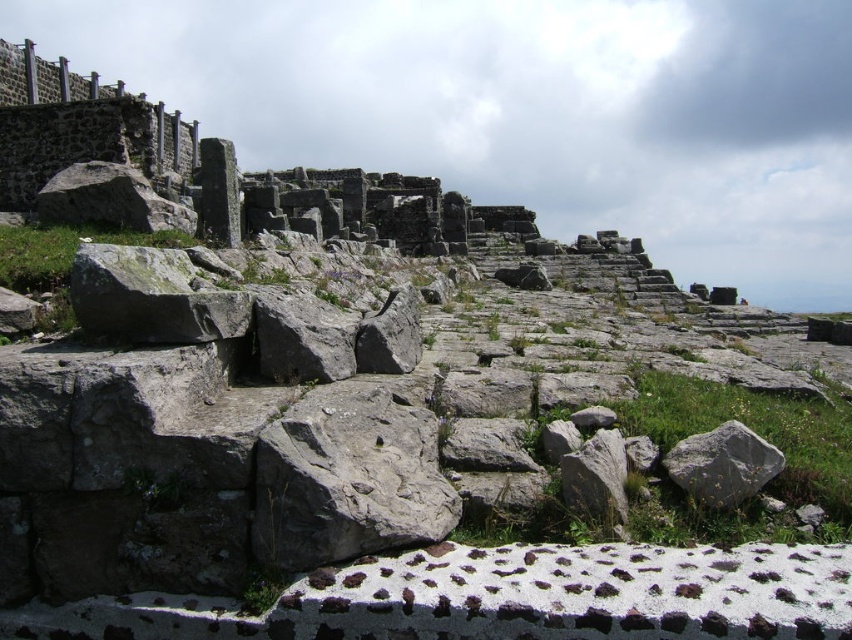
Question: Does gray rough stone at center appear on the left side of gray rough rock at center?

Choices:
 (A) no
 (B) yes

Answer: (B)

Question: Among these objects, which one is farthest from the camera?

Choices:
 (A) gray rough rock at center
 (B) gray rough stone at center

Answer: (A)

Question: In this image, where is gray rough stone at center located relative to gray rough rock at center?

Choices:
 (A) above
 (B) below

Answer: (A)

Question: Which object appears closest to the camera in this image?

Choices:
 (A) gray rough stone at center
 (B) gray rough rock at center

Answer: (A)

Question: Does gray rough stone at center lie in front of gray rough rock at center?

Choices:
 (A) no
 (B) yes

Answer: (B)